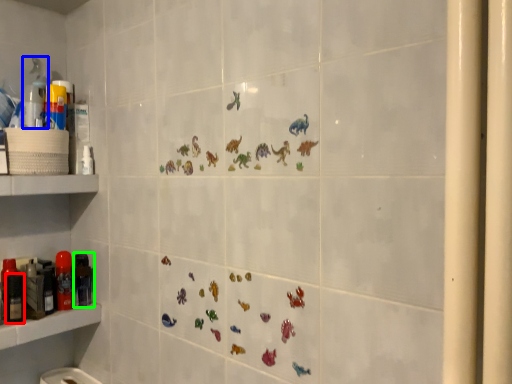
Question: Considering the real-world distances, which object is closest to toiletry (highlighted by a red box)? cleaning product (highlighted by a blue box) or toiletry (highlighted by a green box).

Choices:
 (A) cleaning product
 (B) toiletry

Answer: (B)